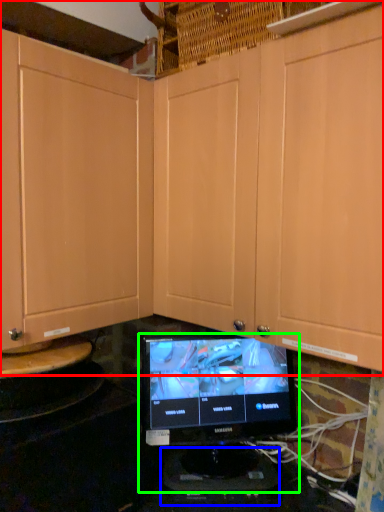
Question: Which object is the closest to the cabinetry (highlighted by a red box)? Choose among these: appliance (highlighted by a blue box) or computer monitor (highlighted by a green box).

Choices:
 (A) appliance
 (B) computer monitor

Answer: (B)